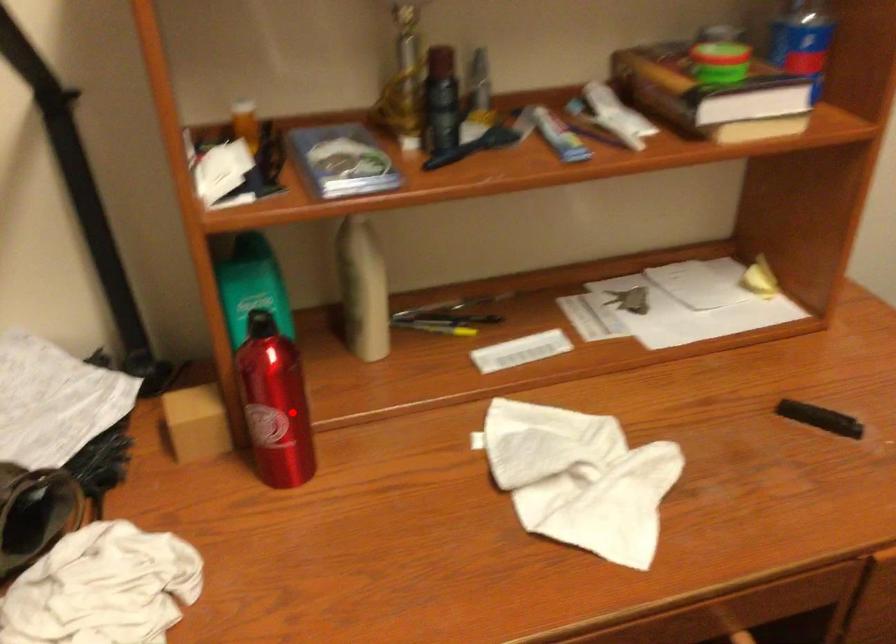
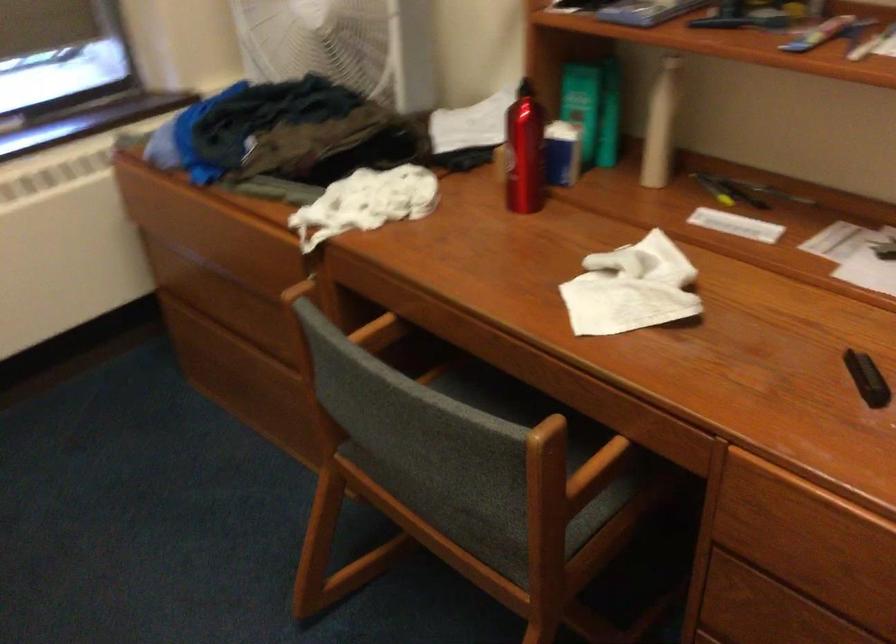
Question: I am providing you with two images of the same scene from different viewpoints. A red point is shown in image1. For the corresponding object point in image2, is it positioned nearer or farther from the camera?

Choices:
 (A) Nearer
 (B) Farther

Answer: (B)